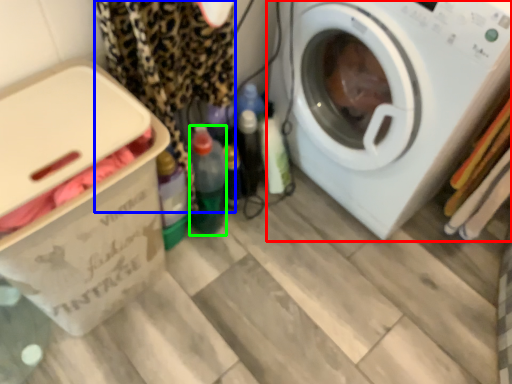
Question: Considering the real-world distances, which object is farthest from washing machine (highlighted by a red box)? clothing (highlighted by a blue box) or bottle (highlighted by a green box)?

Choices:
 (A) clothing
 (B) bottle

Answer: (B)